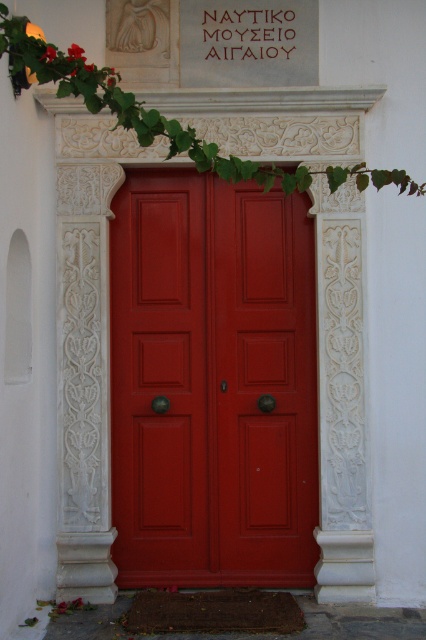
You are an architect designing a new museum entrance. You need to install a security camera that can monitor both the matte wood door at center and the green leafy ivy at upper center. The camera has a 10 feet range. Will the camera be able to cover both objects?

The matte wood door at center and green leafy ivy at upper center are 6.77 feet apart from each other. Since the camera has a 10 feet range, it can easily cover both objects as the distance between them is well within the camera range.

You are standing in front of the entrance and want to locate the point at coordinates (212,381). Based on the scene description, where would this point be located?

The point at coordinates (212,381) is on the glossy wood door at center.